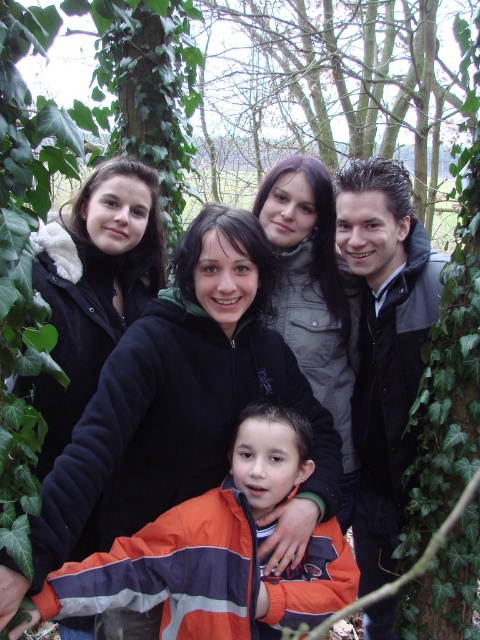
Question: Which of the following is the closest to the observer?

Choices:
 (A) (368, 577)
 (B) (225, 490)

Answer: (B)

Question: Is orange fleece jacket at lower center to the right of black fleece jacket at center from the viewer's perspective?

Choices:
 (A) no
 (B) yes

Answer: (A)

Question: Which of the following is the farthest from the observer?

Choices:
 (A) (111, 456)
 (B) (87, 573)
 (C) (300, 365)

Answer: (C)

Question: Does orange fleece jacket at lower center have a greater width compared to black fleece jacket at center?

Choices:
 (A) no
 (B) yes

Answer: (A)

Question: Which point appears farthest from the camera in this image?

Choices:
 (A) tap(304, 224)
 (B) tap(272, 600)
 (C) tap(369, 186)

Answer: (A)

Question: Considering the relative positions of orange fleece jacket at lower center and matte gray jacket at upper center in the image provided, where is orange fleece jacket at lower center located with respect to matte gray jacket at upper center?

Choices:
 (A) above
 (B) below

Answer: (B)